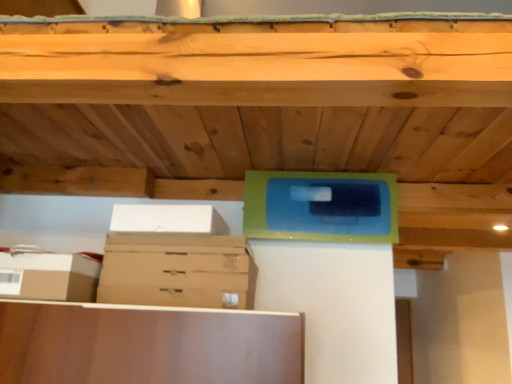
Question: Is brown cardboard box at lower left, the first storage box in the bottom-to-top sequence, in front of brown cardboard drawer at center?

Choices:
 (A) yes
 (B) no

Answer: (A)

Question: Is brown cardboard box at lower left, the first storage box viewed from the left, behind brown cardboard drawer at center?

Choices:
 (A) no
 (B) yes

Answer: (A)

Question: From the image's perspective, does brown cardboard box at lower left, which appears as the 2th storage box when viewed from the top, appear higher than brown cardboard drawer at center?

Choices:
 (A) no
 (B) yes

Answer: (A)

Question: Can you confirm if brown cardboard box at lower left, which appears as the second storage box when viewed from the right, is shorter than brown cardboard drawer at center?

Choices:
 (A) yes
 (B) no

Answer: (B)

Question: Does brown cardboard box at lower left, the first storage box viewed from the left, have a smaller size compared to brown cardboard drawer at center?

Choices:
 (A) yes
 (B) no

Answer: (A)

Question: Is white cardboard box at upper left, the second storage box positioned from the bottom, inside the boundaries of brown cardboard drawer at center, or outside?

Choices:
 (A) outside
 (B) inside

Answer: (A)

Question: From a real-world perspective, is white cardboard box at upper left, the 1th storage box in the right-to-left sequence, positioned above or below brown cardboard drawer at center?

Choices:
 (A) above
 (B) below

Answer: (A)

Question: Does point (152, 208) appear closer or farther from the camera than point (187, 286)?

Choices:
 (A) farther
 (B) closer

Answer: (A)

Question: Considering the positions of white cardboard box at upper left, the second storage box positioned from the bottom, and brown cardboard drawer at center in the image, is white cardboard box at upper left, the second storage box positioned from the bottom, wider or thinner than brown cardboard drawer at center?

Choices:
 (A) wide
 (B) thin

Answer: (A)

Question: In the image, is white cardboard box at upper left, the 1th storage box in the right-to-left sequence, on the left side or the right side of brown cardboard box at lower left, which appears as the 2th storage box when viewed from the top?

Choices:
 (A) left
 (B) right

Answer: (B)

Question: Is white cardboard box at upper left, the second storage box positioned from the bottom, situated inside brown cardboard box at lower left, which appears as the second storage box when viewed from the right, or outside?

Choices:
 (A) outside
 (B) inside

Answer: (A)

Question: Is white cardboard box at upper left, arranged as the 2th storage box when viewed from the left, wider or thinner than brown cardboard box at lower left, which appears as the 2th storage box when viewed from the top?

Choices:
 (A) wide
 (B) thin

Answer: (A)

Question: Does point (188, 221) appear closer or farther from the camera than point (57, 281)?

Choices:
 (A) closer
 (B) farther

Answer: (B)

Question: Considering their positions, is brown cardboard drawer at center located in front of or behind brown cardboard box at lower left, the first storage box in the bottom-to-top sequence?

Choices:
 (A) front
 (B) behind

Answer: (B)

Question: From a real-world perspective, is brown cardboard drawer at center physically located above or below brown cardboard box at lower left, the first storage box viewed from the left?

Choices:
 (A) above
 (B) below

Answer: (A)